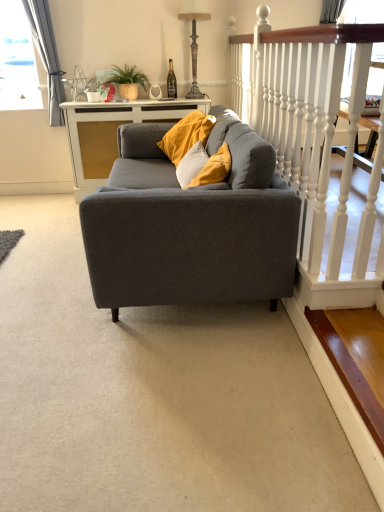
Where is `vacant region to the left of matte gray couch at center`? The image size is (384, 512). vacant region to the left of matte gray couch at center is located at coordinates (43, 250).